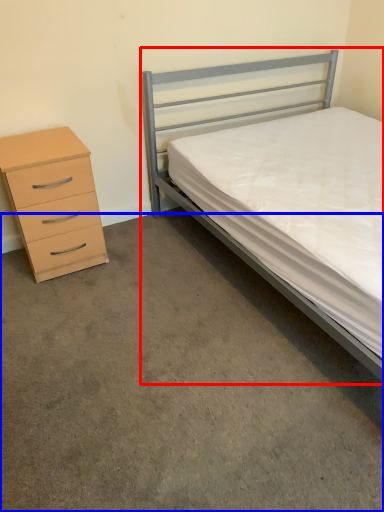
Question: Which object appears closest to the camera in this image, bed (highlighted by a red box) or concrete (highlighted by a blue box)?

Choices:
 (A) bed
 (B) concrete

Answer: (B)